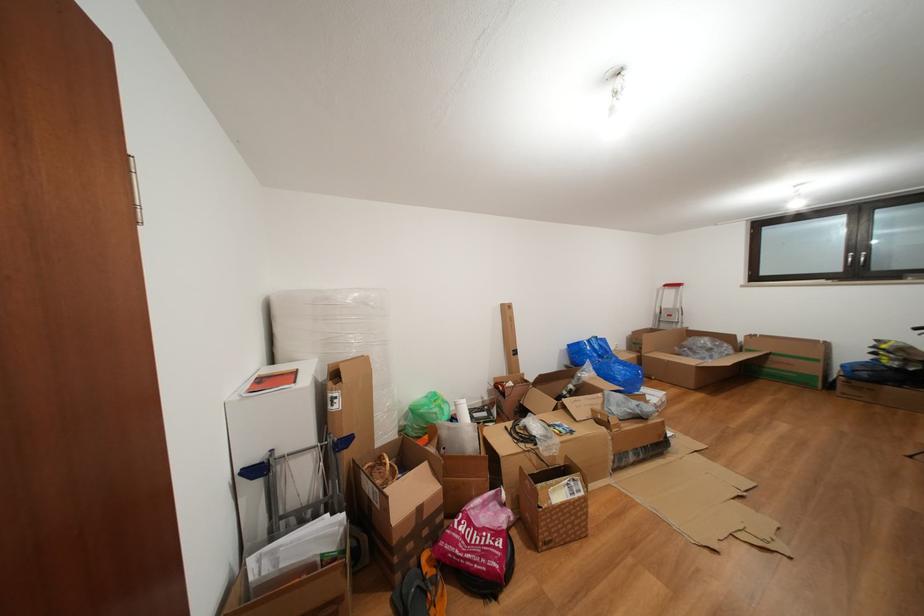
At what (x,y) coordinates should I click in order to perform the action: click on pink shopping bag. Please return your answer as a coordinate pair (x, y). Looking at the image, I should click on (479, 538).